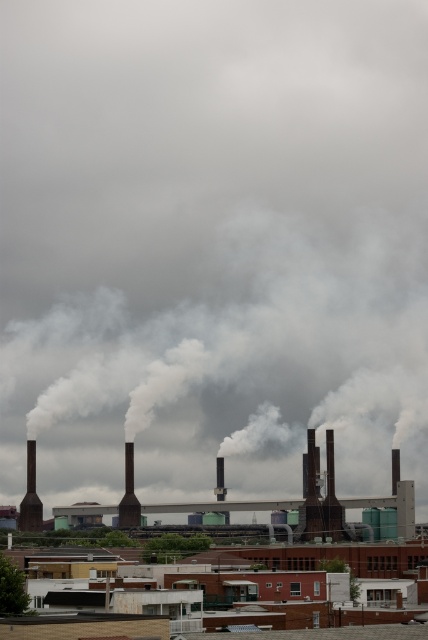
In the scene shown: You are a drone operator tasked with capturing aerial footage of the industrial area. Your drone is currently hovering at point (77, 625). What object will the drone be directly above?

The drone is directly above the brown industrial building at center located at point (77, 625).

You are a drone operator tasked with capturing aerial footage of the brown industrial building at center and the black matte chimney at center. Based on their heights, which one will appear larger in the camera frame when viewed from the same distance?

The brown industrial building at center appears larger in the camera frame because it has a greater height compared to the black matte chimney at center.